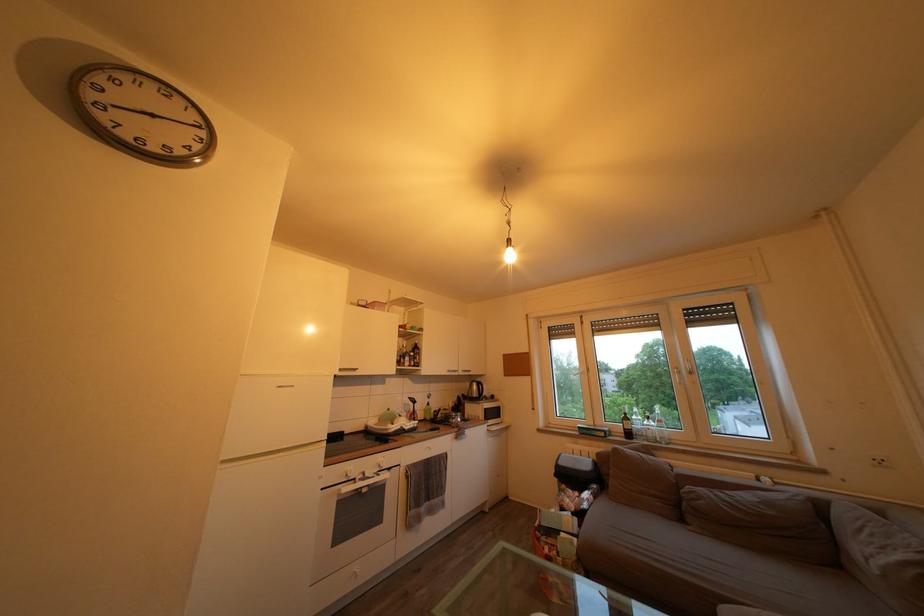
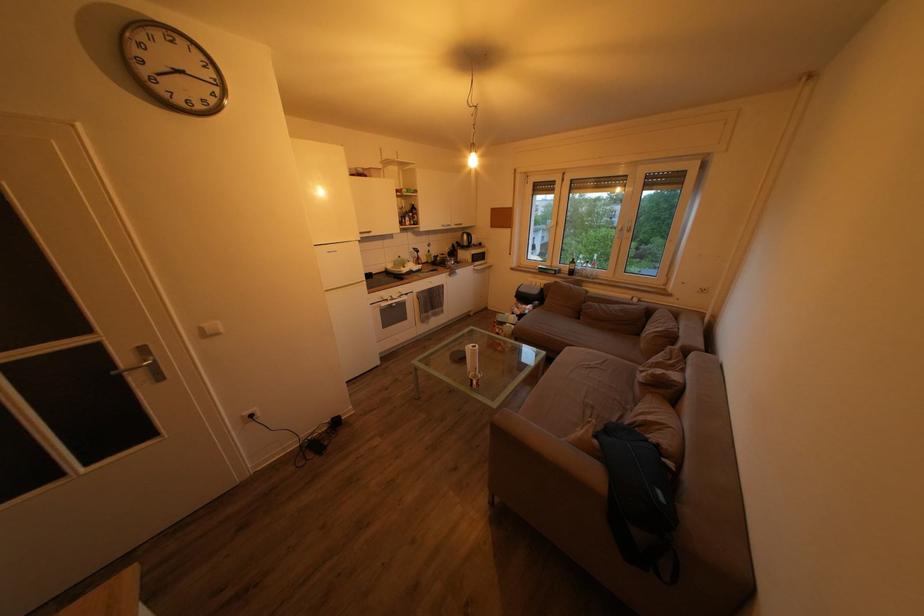
The point at (468, 379) is marked in the first image. Where is the corresponding point in the second image?

(462, 233)